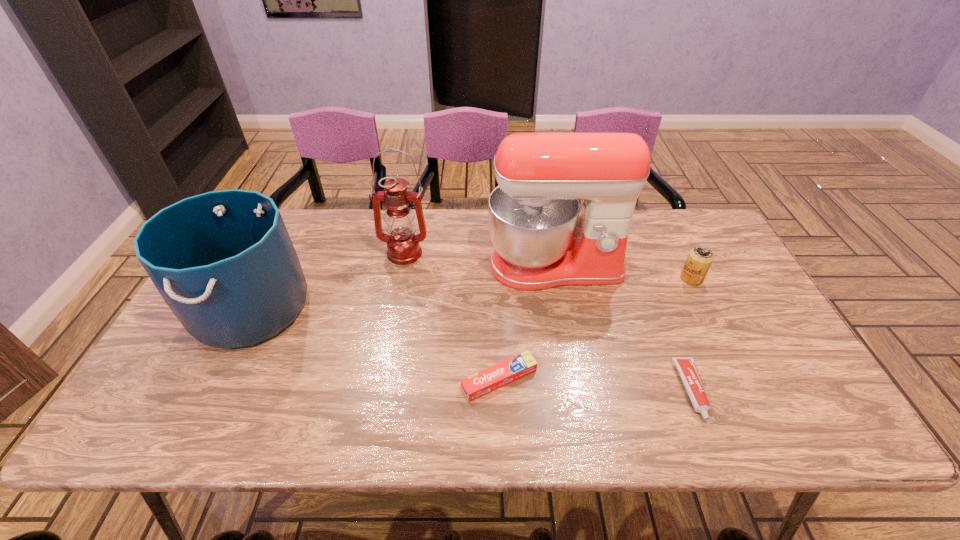
In order to click on vacant area between the left toothpaste and the rightmost object in this screenshot , I will do `click(595, 329)`.

Where is `empty space between the right toothpaste and the second object from left to right`? The height and width of the screenshot is (540, 960). empty space between the right toothpaste and the second object from left to right is located at coordinates (547, 322).

You are a GUI agent. You are given a task and a screenshot of the screen. Output one action in this format:
    pyautogui.click(x=<x>, y=<y>)
    Task: Click on the free space between the right toothpaste and the fourth tallest object
    The width and height of the screenshot is (960, 540).
    Given the screenshot: What is the action you would take?
    pyautogui.click(x=691, y=334)

Locate an element on the screen. The image size is (960, 540). free spot between the second object from left to right and the mixer is located at coordinates (479, 259).

You are a GUI agent. You are given a task and a screenshot of the screen. Output one action in this format:
    pyautogui.click(x=<x>, y=<y>)
    Task: Click on the free space between the rightmost object and the left toothpaste
    
    Given the screenshot: What is the action you would take?
    pyautogui.click(x=595, y=329)

This screenshot has width=960, height=540. I want to click on unoccupied area between the mixer and the oil lamp, so click(x=479, y=259).

Where is `free point between the second object from right to left and the beer can`? The image size is (960, 540). free point between the second object from right to left and the beer can is located at coordinates (691, 334).

At what (x,y) coordinates should I click in order to perform the action: click on free area in between the right toothpaste and the oil lamp. Please return your answer as a coordinate pair (x, y). This screenshot has height=540, width=960. Looking at the image, I should click on (547, 322).

Identify the location of vacant point located between the bucket and the rightmost object. The height and width of the screenshot is (540, 960). (471, 293).

Identify which object is located as the nearest to the second object from right to left. Please provide its 2D coordinates. Your answer should be formatted as a tuple, i.e. [(x, y)], where the tuple contains the x and y coordinates of a point satisfying the conditions above.

[(543, 237)]